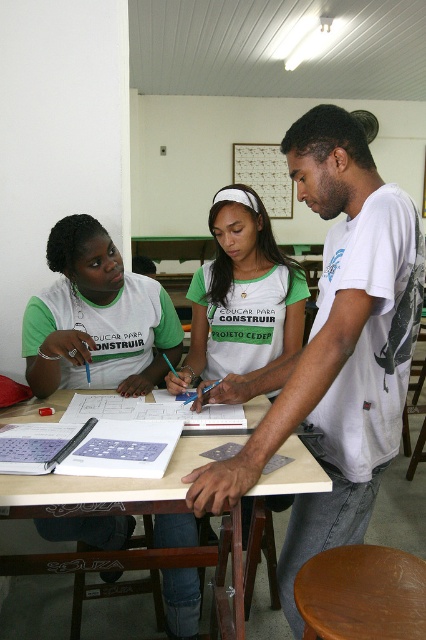
You are standing at the point labeled as point (x=233, y=172) and want to walk to the point labeled point (x=316, y=563). According to the scene description, which direction should you move to reach your destination?

You should move forward because point (x=316, y=563) is in front of point (x=233, y=172).

You are a student sitting at the table in the classroom. You notice two points marked on the blueprint. The first point is at coordinates point (391, 362) and the second is at point (416, 572). Which point is closer to you?

Point (391, 362) is in front of point (416, 572), so it is closer to you.